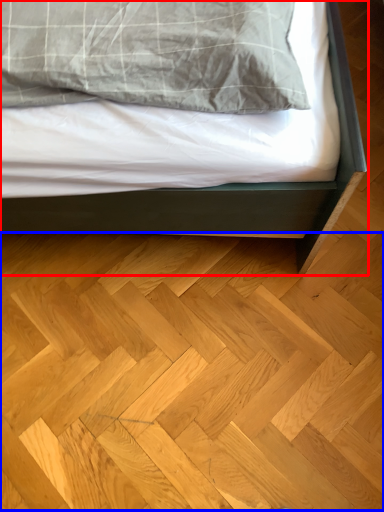
Question: Which object is further to the camera taking this photo, bed (highlighted by a red box) or hardwood (highlighted by a blue box)?

Choices:
 (A) bed
 (B) hardwood

Answer: (B)